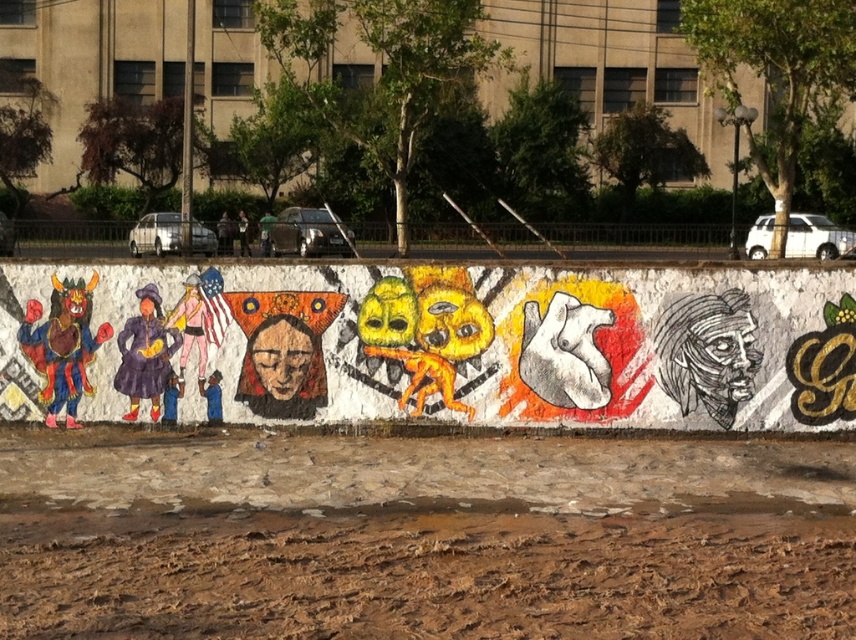
Question: Among these objects, which one is nearest to the camera?

Choices:
 (A) brown textured dirt at lower center
 (B) vibrant painted mural at center

Answer: (A)

Question: Among these points, which one is nearest to the camera?

Choices:
 (A) (506, 625)
 (B) (580, 358)

Answer: (A)

Question: Where is brown textured dirt at lower center located in relation to vibrant painted mural at center in the image?

Choices:
 (A) right
 (B) left

Answer: (B)

Question: Is brown textured dirt at lower center further to the viewer compared to vibrant painted mural at center?

Choices:
 (A) yes
 (B) no

Answer: (B)

Question: In this image, where is brown textured dirt at lower center located relative to vibrant painted mural at center?

Choices:
 (A) left
 (B) right

Answer: (A)